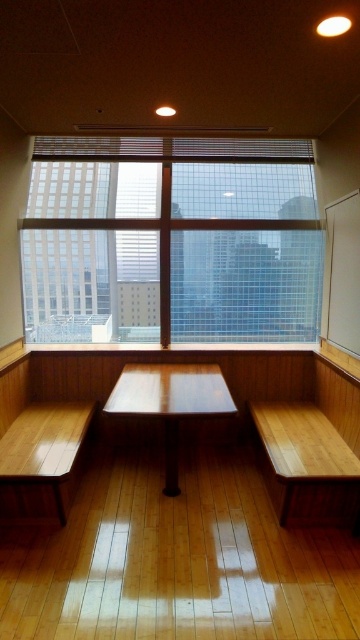
You are a delivery person carrying a large package that is 1.2 meters wide. You need to exit through the clear glass window at upper center. Can you fit through the window without tilting the package? Please consider the width of the window compared to the light brown wood bench at left.

The clear glass window at upper center might be wider than light brown wood bench at left, so there is a possibility that the window is wide enough for the 1.2 meter package. However, since the exact width of the bench is unknown, it is uncertain if the window can accommodate the package without tilting.

You are sitting at the table in the center of the room and want to look out the clear glass window at upper center. To your left, there is a light brown wood bench at left. In which direction should you turn your head to see the window?

You should turn your head to the right because the clear glass window at upper center is to the right of the light brown wood bench at left, which is on your left side.

You are planning to hang a large poster on the wall in the room. The poster is as wide as the clear glass window at upper center. Will it also fit over the wooden picnic table at center?

The clear glass window at upper center is larger than the wooden picnic table at center. Since the poster is as wide as the window, it will be wider than the table, so it should fit over the wooden picnic table at center.